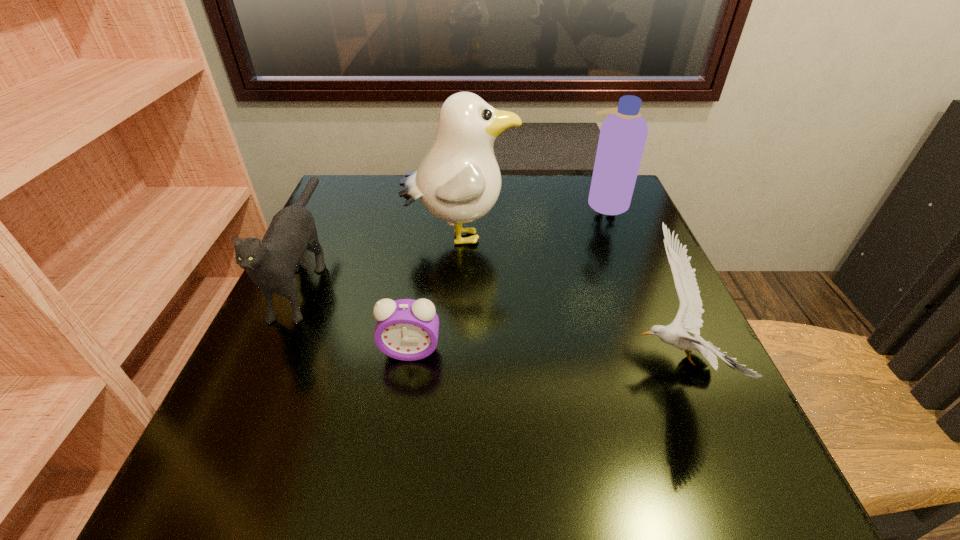
In order to click on the farther gull in this screenshot , I will do `click(459, 181)`.

Locate an element on the screen. The width and height of the screenshot is (960, 540). the tallest object is located at coordinates (459, 181).

Find the location of `the second tallest object`. the second tallest object is located at coordinates (623, 134).

This screenshot has height=540, width=960. What are the coordinates of `cat` in the screenshot? It's located at pyautogui.click(x=271, y=264).

I want to click on the shorter gull, so click(688, 319).

Locate an element on the screen. The image size is (960, 540). the right gull is located at coordinates (688, 319).

Identify the location of the shortest object. The width and height of the screenshot is (960, 540). (406, 329).

Find the location of a particular element. vacant space located on the beak of the tallest object is located at coordinates (643, 237).

What are the coordinates of `free point located on the front of the shampoo` in the screenshot? It's located at (659, 332).

Image resolution: width=960 pixels, height=540 pixels. Find the location of `vacant space located 0.180m on the front-facing side of the cat`. vacant space located 0.180m on the front-facing side of the cat is located at coordinates (231, 435).